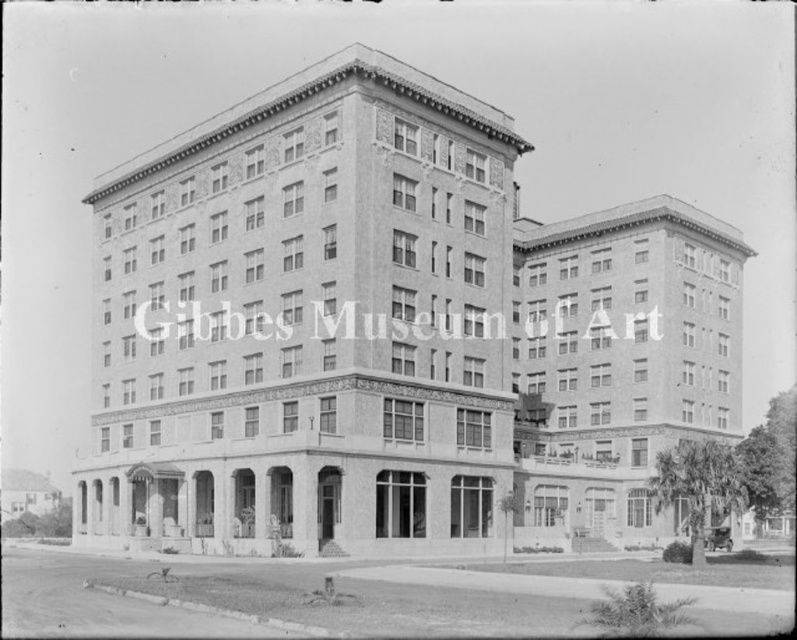
You are standing at the entrance of the smooth stone building at center. You want to walk to the nearby park entrance that is 200 feet away from you. Can you reach the park entrance without crossing any roads?

The smooth stone building at center is 208.10 feet away from the park entrance, so yes, you can reach the park entrance without crossing any roads since it is within the 200 feet distance.

You are standing in front of the building shown in the image. You notice two distinct textures on the building facade. The smooth stone building at center and the brick textured building at center. Which texture is located higher up on the building?

The smooth stone building at center is above the brick textured building at center, so the smooth stone texture is higher up on the building.